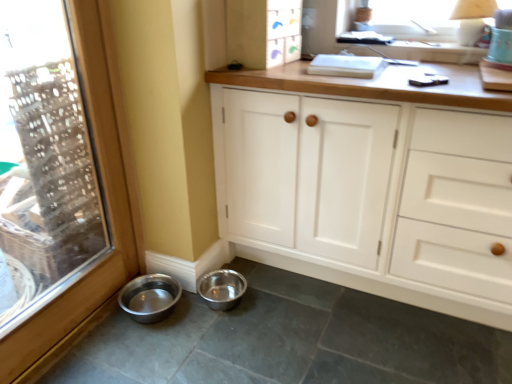
Locate an element on the screen. The width and height of the screenshot is (512, 384). blank area beneath metallic silver bowl at lower left, which is counted as the first basin, starting from the left (from a real-world perspective) is located at coordinates (152, 308).